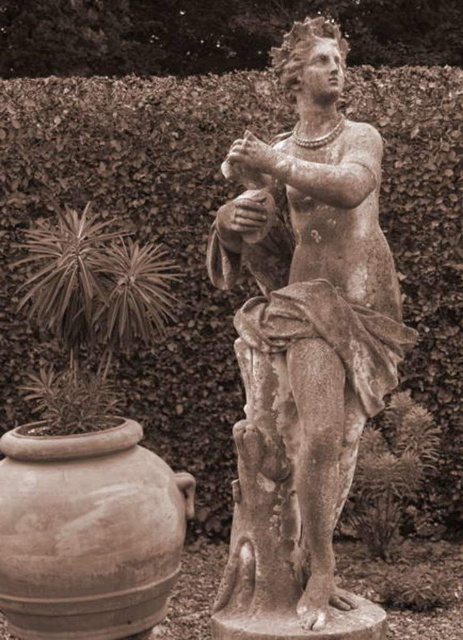
You are a gardener who wants to place a new decorative item in the garden. You have a choice between placing it in front of the green leafy hedge at upper center or behind the brown clay vase at lower left. Which placement would make the item more visible to someone standing at the garden entrance?

Placing the item in front of the green leafy hedge at upper center would make it more visible because the brown clay vase at lower left is behind the green leafy hedge at upper center, so placing it behind the vase would hide it from view.